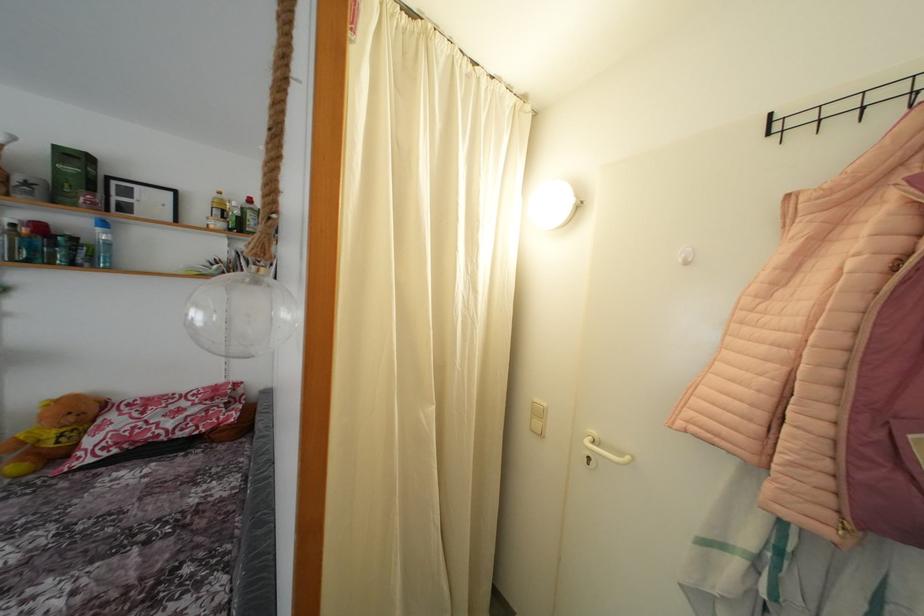
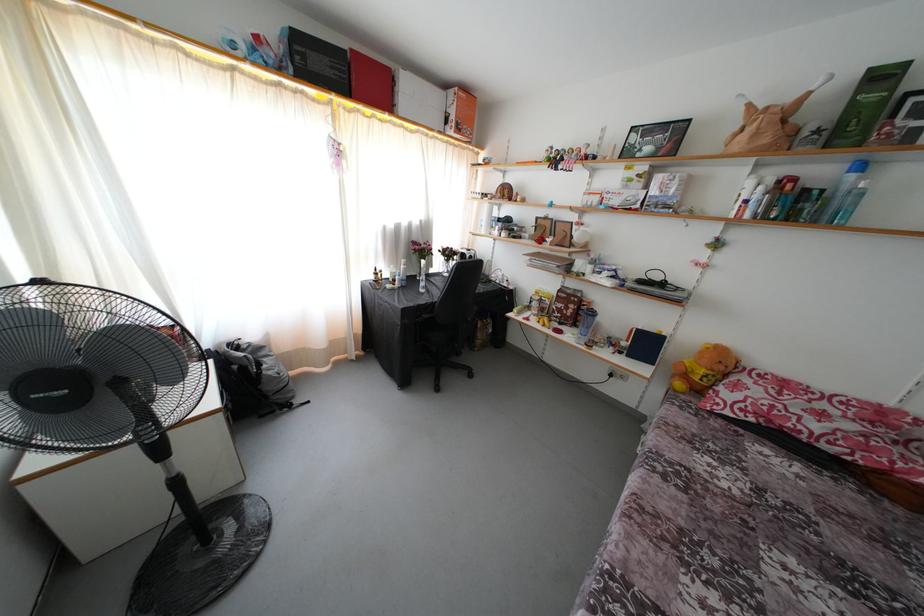
Locate, in the second image, the point that corresponds to [77,424] in the first image.

(726, 373)